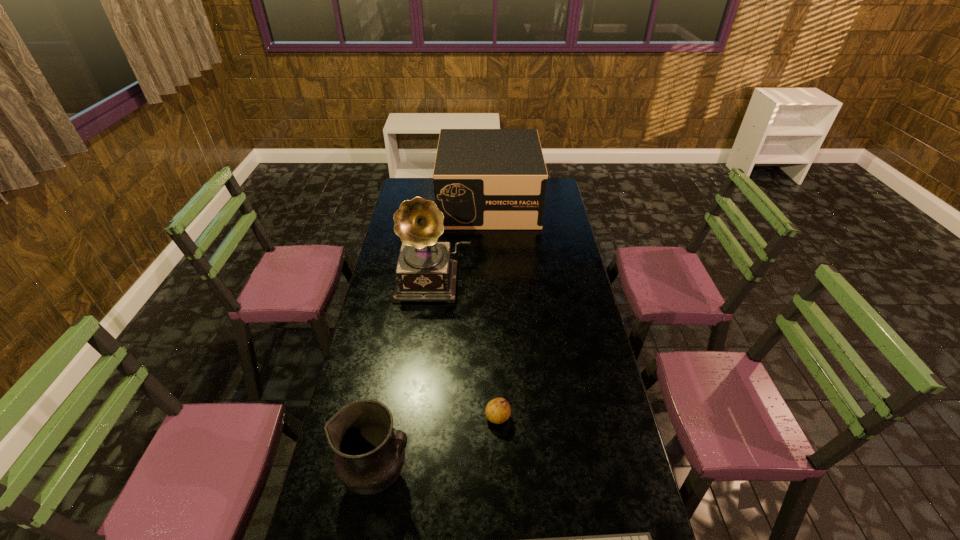
Where is `empty location between the fourth tallest object and the second farthest object`? empty location between the fourth tallest object and the second farthest object is located at coordinates (466, 349).

Locate an element on the screen. The image size is (960, 540). free point between the pear and the fourth farthest object is located at coordinates (438, 446).

The height and width of the screenshot is (540, 960). Find the location of `vacant space in between the fourth farthest object and the box`. vacant space in between the fourth farthest object and the box is located at coordinates (434, 339).

Identify the location of vacant space that is in between the farthest object and the second farthest object. (462, 241).

You are a GUI agent. You are given a task and a screenshot of the screen. Output one action in this format:
    pyautogui.click(x=<x>, y=<y>)
    Task: Click on the empty space that is in between the record player and the third nearest object
    
    Given the screenshot: What is the action you would take?
    pyautogui.click(x=466, y=349)

Locate an element on the screen. The height and width of the screenshot is (540, 960). the fourth closest object to the shortest object is located at coordinates (484, 179).

At what (x,y) coordinates should I click in order to perform the action: click on object that is the second closest to the computer keyboard. Please return your answer as a coordinate pair (x, y). This screenshot has width=960, height=540. Looking at the image, I should click on [497, 411].

Identify the location of vacant space that satisfies the following two spatial constraints: 1. on the front-facing side of the farthest object; 2. on the handle side of the second nearest object. (496, 476).

Where is `free space in the image that satisfies the following two spatial constraints: 1. on the horn of the tallest object; 2. on the handle side of the second nearest object`? free space in the image that satisfies the following two spatial constraints: 1. on the horn of the tallest object; 2. on the handle side of the second nearest object is located at coordinates (411, 476).

In order to click on free location that satisfies the following two spatial constraints: 1. on the horn of the third nearest object; 2. on the left side of the record player in this screenshot , I will do `click(418, 417)`.